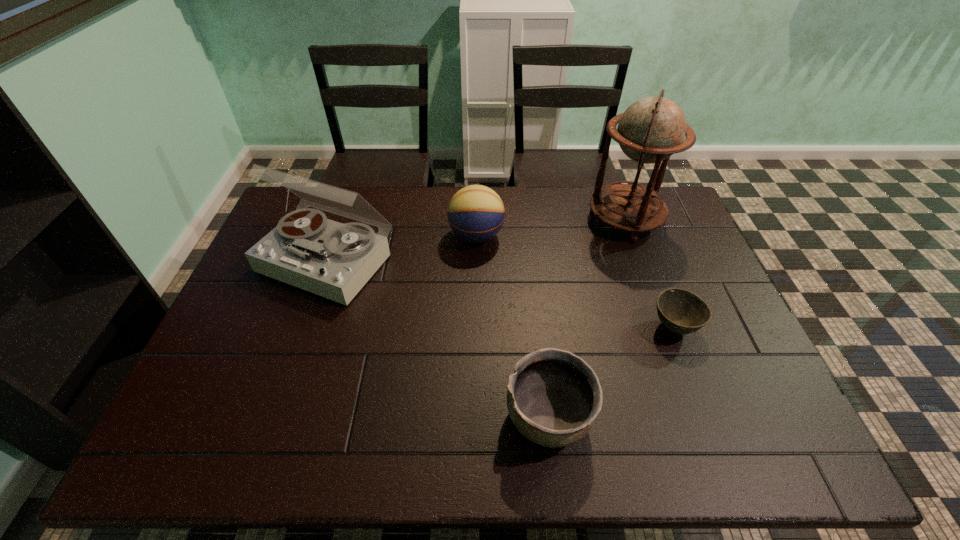
Image resolution: width=960 pixels, height=540 pixels. I want to click on blank area in the image that satisfies the following two spatial constraints: 1. on the surface of the second nearest object; 2. on the left side of the globe, so click(x=663, y=327).

Image resolution: width=960 pixels, height=540 pixels. I want to click on vacant space that satisfies the following two spatial constraints: 1. on the front side of the record player; 2. on the left side of the bowl, so click(304, 327).

This screenshot has width=960, height=540. In order to click on vacant space that satisfies the following two spatial constraints: 1. on the surface of the tallest object; 2. on the front side of the fourth shortest object in this screenshot , I will do `click(639, 261)`.

Identify the location of vacant area that satisfies the following two spatial constraints: 1. on the surface of the shortest object; 2. on the right side of the globe. The image size is (960, 540). (663, 327).

The width and height of the screenshot is (960, 540). What are the coordinates of `vacant area in the image that satisfies the following two spatial constraints: 1. on the patterned surface of the third shortest object; 2. on the back side of the nearest object` in the screenshot? It's located at (475, 417).

Identify the location of blank area in the image that satisfies the following two spatial constraints: 1. on the back side of the fourth farthest object; 2. on the surface of the globe. Image resolution: width=960 pixels, height=540 pixels. (633, 220).